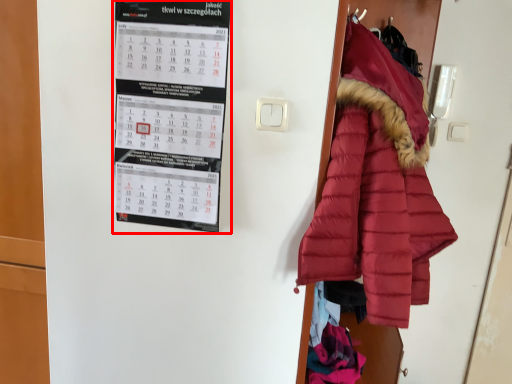
Question: From the image's perspective, what is the correct spatial relationship of bulletin board (annotated by the red box) in relation to coat?

Choices:
 (A) above
 (B) below

Answer: (A)